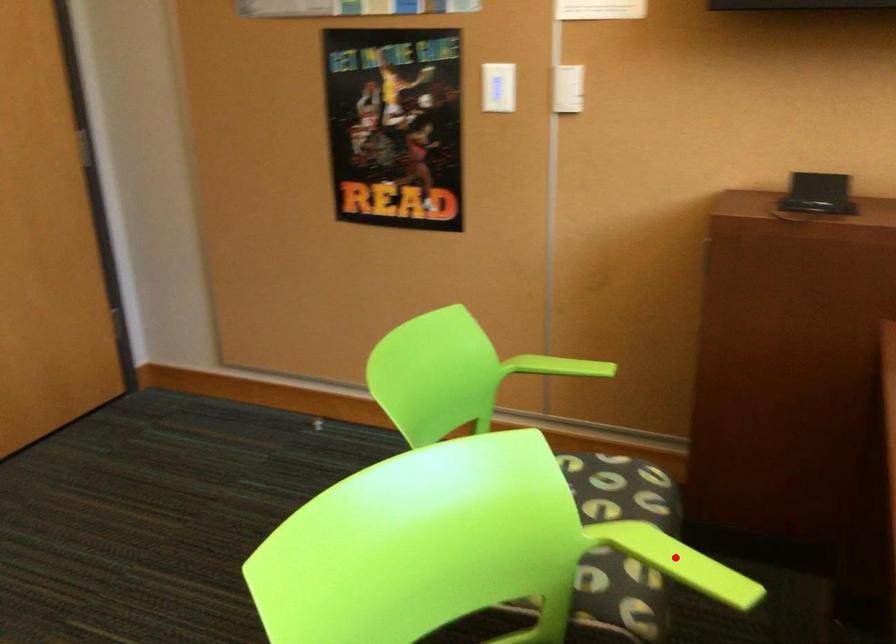
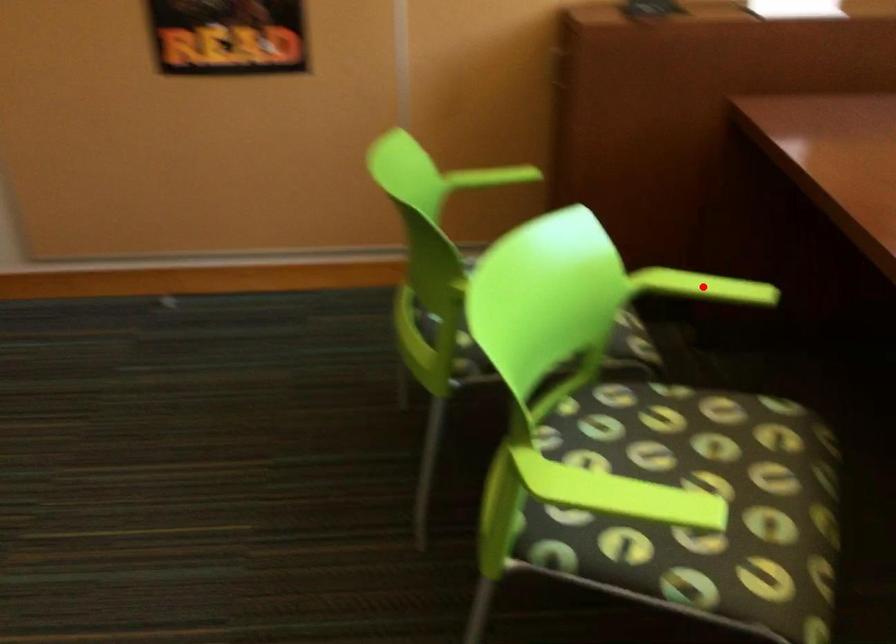
I am providing you with two images of the same scene from different viewpoints. A red point is marked on the first image and another point is marked on the second image. Is the red point in image1 aligned with the point shown in image2?

Yes